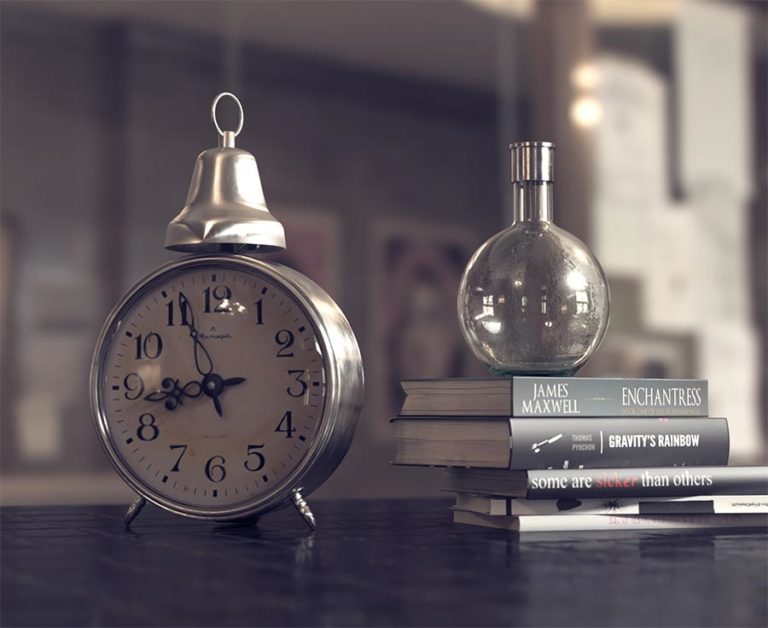
Where is `silver rim around clock`? silver rim around clock is located at coordinates (345, 364).